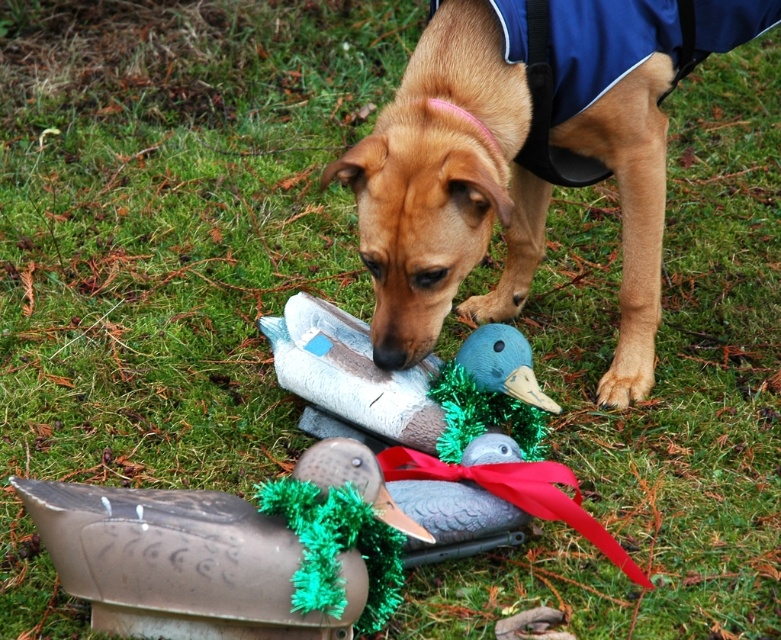
Question: Where is brown matte dog at center located in relation to metallic duck at lower center in the image?

Choices:
 (A) below
 (B) above

Answer: (B)

Question: Which of these objects is positioned farthest from the metallic duck at lower center?

Choices:
 (A) brown matte dog at center
 (B) metallic duck decoy at center

Answer: (A)

Question: Which object is positioned farthest from the brown matte dog at center?

Choices:
 (A) metallic duck at lower center
 (B) metallic duck decoy at center

Answer: (A)

Question: Is the position of metallic duck at lower center more distant than that of metallic duck decoy at center?

Choices:
 (A) yes
 (B) no

Answer: (B)

Question: Among these points, which one is farthest from the camera?

Choices:
 (A) (490, 230)
 (B) (330, 394)

Answer: (B)

Question: Does brown matte dog at center have a greater width compared to metallic duck at lower center?

Choices:
 (A) yes
 (B) no

Answer: (A)